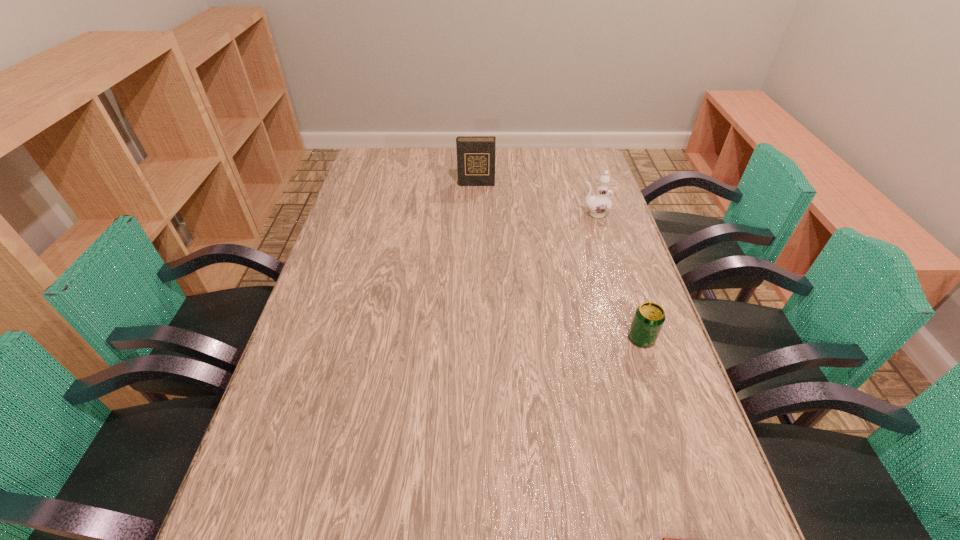
I want to click on the taller diary, so (x=475, y=154).

The height and width of the screenshot is (540, 960). In order to click on the leftmost object in this screenshot , I will do `click(475, 154)`.

Locate an element on the screen. chinaware is located at coordinates (599, 204).

Where is `the second nearest object`? The height and width of the screenshot is (540, 960). the second nearest object is located at coordinates [x=649, y=317].

What are the coordinates of `the third tallest object` in the screenshot? It's located at (649, 317).

The width and height of the screenshot is (960, 540). I want to click on free space located 0.400m on the front cover of the farthest object, so click(x=475, y=259).

Image resolution: width=960 pixels, height=540 pixels. Identify the location of vacant region located at the spout of the second farthest object. (540, 214).

Where is `vacant space positioned at the spout of the second farthest object`? The image size is (960, 540). vacant space positioned at the spout of the second farthest object is located at coordinates (552, 214).

Locate an element on the screen. free space located at the spout of the second farthest object is located at coordinates (464, 214).

Identify the location of vacant area situated on the left of the third farthest object. (568, 338).